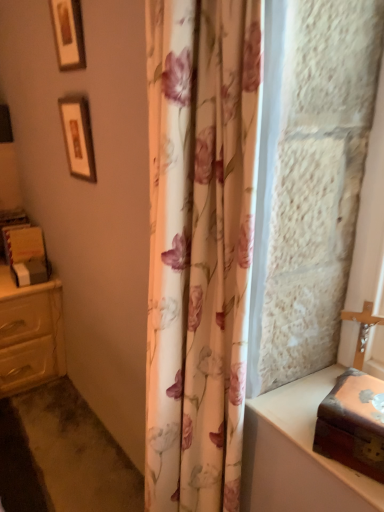
Question: Is floral fabric shower curtain at center closer to the viewer compared to matte cream chest of drawers at left?

Choices:
 (A) no
 (B) yes

Answer: (B)

Question: Is floral fabric shower curtain at center thinner than matte cream chest of drawers at left?

Choices:
 (A) no
 (B) yes

Answer: (B)

Question: From the image's perspective, would you say floral fabric shower curtain at center is shown under matte cream chest of drawers at left?

Choices:
 (A) no
 (B) yes

Answer: (A)

Question: Can you confirm if floral fabric shower curtain at center is bigger than matte cream chest of drawers at left?

Choices:
 (A) yes
 (B) no

Answer: (A)

Question: Is floral fabric shower curtain at center at the right side of matte cream chest of drawers at left?

Choices:
 (A) no
 (B) yes

Answer: (B)

Question: From a real-world perspective, is floral fabric shower curtain at center above or below wooden framed picture at upper left, the second picture frame in the top-to-bottom sequence?

Choices:
 (A) below
 (B) above

Answer: (A)

Question: Relative to wooden framed picture at upper left, the second picture frame in the top-to-bottom sequence, is floral fabric shower curtain at center in front or behind?

Choices:
 (A) behind
 (B) front

Answer: (B)

Question: Based on their sizes in the image, would you say floral fabric shower curtain at center is bigger or smaller than wooden framed picture at upper left, the second picture frame in the top-to-bottom sequence?

Choices:
 (A) big
 (B) small

Answer: (A)

Question: From the image's perspective, is floral fabric shower curtain at center above or below wooden framed picture at upper left, the second picture frame in the top-to-bottom sequence?

Choices:
 (A) below
 (B) above

Answer: (A)

Question: Considering their positions, is wooden framed picture at upper left, marked as the 2th picture frame in a bottom-to-top arrangement, located in front of or behind wooden box at right?

Choices:
 (A) front
 (B) behind

Answer: (B)

Question: From a real-world perspective, is wooden framed picture at upper left, which is counted as the first picture frame, starting from the top, physically located above or below wooden box at right?

Choices:
 (A) below
 (B) above

Answer: (B)

Question: Would you say wooden framed picture at upper left, marked as the 2th picture frame in a bottom-to-top arrangement, is to the left or to the right of wooden box at right in the picture?

Choices:
 (A) left
 (B) right

Answer: (A)

Question: From the image's perspective, relative to wooden box at right, is wooden framed picture at upper left, which is counted as the first picture frame, starting from the top, above or below?

Choices:
 (A) below
 (B) above

Answer: (B)

Question: Visually, is wooden framed picture at upper left, marked as the 2th picture frame in a bottom-to-top arrangement, positioned to the left or to the right of matte cream chest of drawers at left?

Choices:
 (A) right
 (B) left

Answer: (A)

Question: From a real-world perspective, is wooden framed picture at upper left, marked as the 2th picture frame in a bottom-to-top arrangement, above or below matte cream chest of drawers at left?

Choices:
 (A) above
 (B) below

Answer: (A)